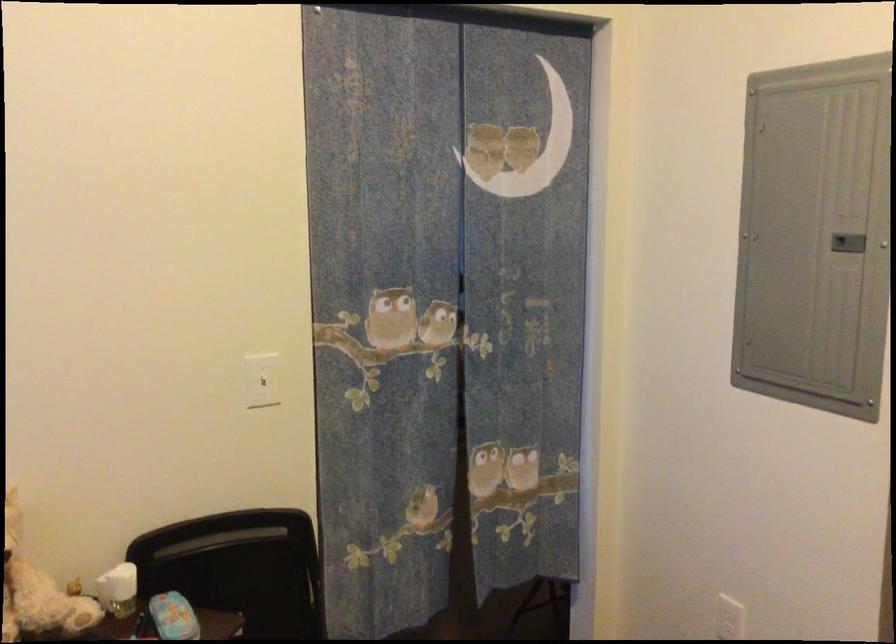
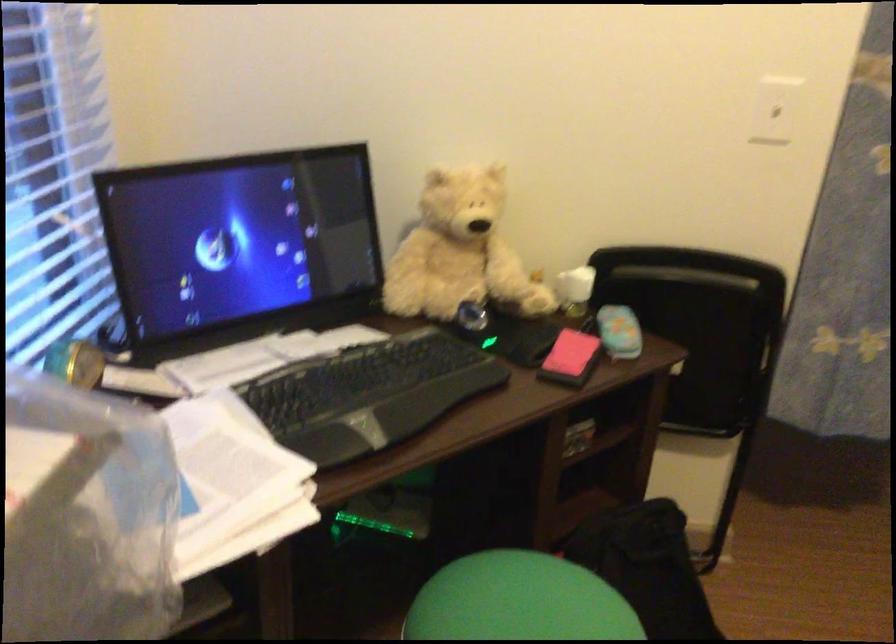
How did the camera likely rotate?

The rotation direction of the camera is left-down.